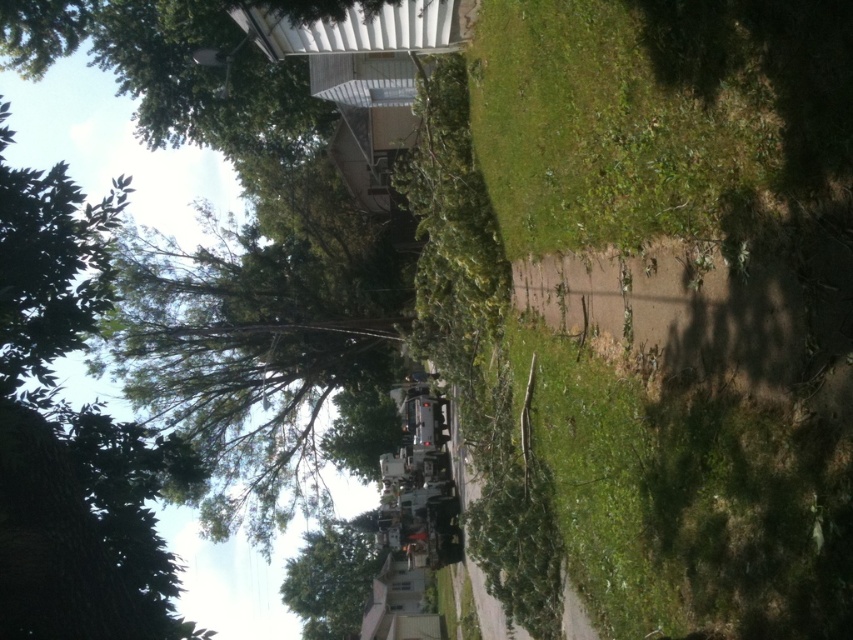
You are a delivery driver trying to navigate through the residential area. You see the green leafy tree at upper left and the green leafy tree at lower center. Which tree is positioned higher up in the image?

The green leafy tree at upper left is positioned higher up in the image than the green leafy tree at lower center.

You are a delivery driver who needs to park your truck on the green grass at center without blocking the green leafy tree at lower center. Based on the scene, can you safely park there?

The green grass at center is smaller than the green leafy tree at lower center, so parking the truck there might not be advisable as the grass area may not be large enough to accommodate the truck without affecting the tree.